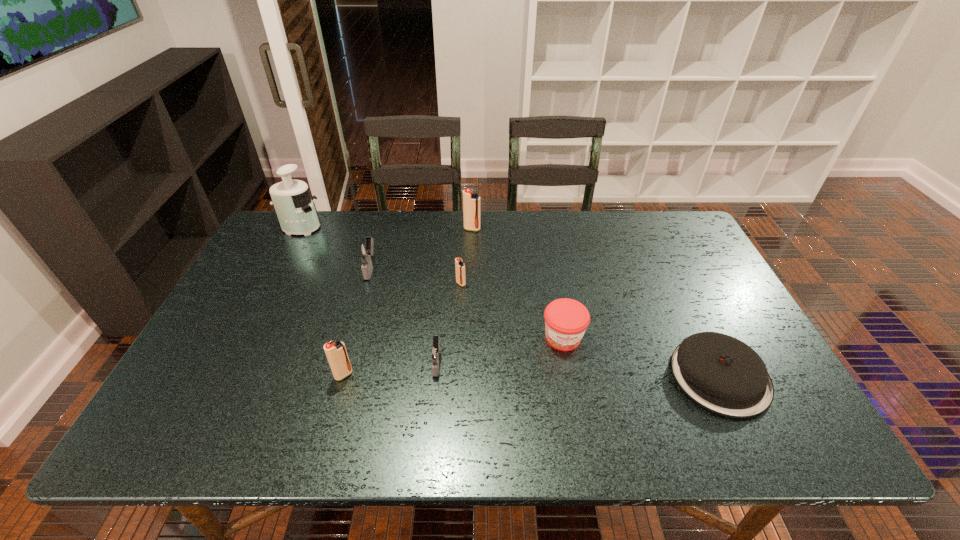
Identify the location of red igniter that is the second closest to the bigger gray igniter. (471, 202).

Where is `vacant position in the image that satisfies the following two spatial constraints: 1. on the front side of the pancake; 2. on the left side of the right gray igniter`? Image resolution: width=960 pixels, height=540 pixels. vacant position in the image that satisfies the following two spatial constraints: 1. on the front side of the pancake; 2. on the left side of the right gray igniter is located at coordinates (436, 376).

The image size is (960, 540). In order to click on vacant space that satisfies the following two spatial constraints: 1. on the front side of the rightmost object; 2. on the right side of the second biggest red igniter in this screenshot , I will do `click(343, 376)`.